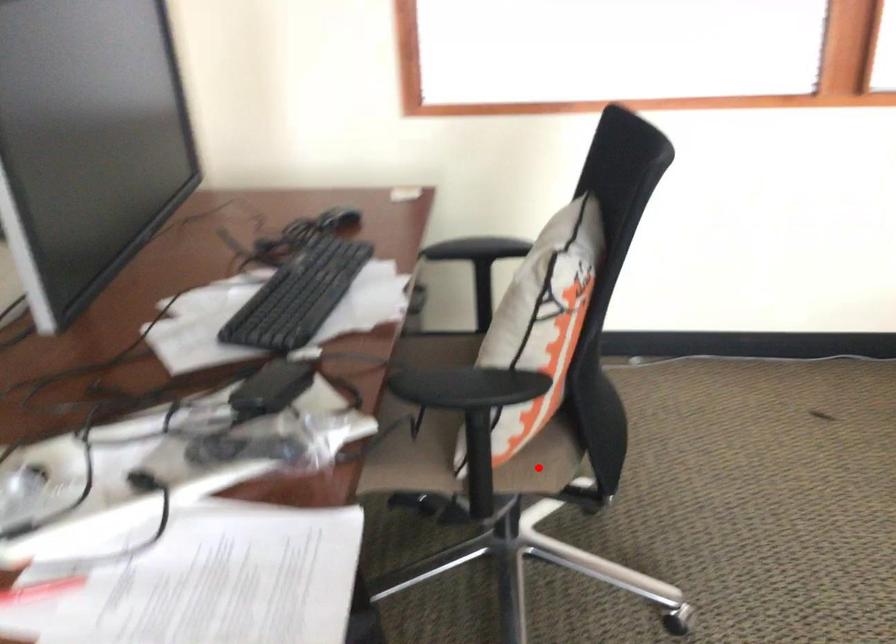
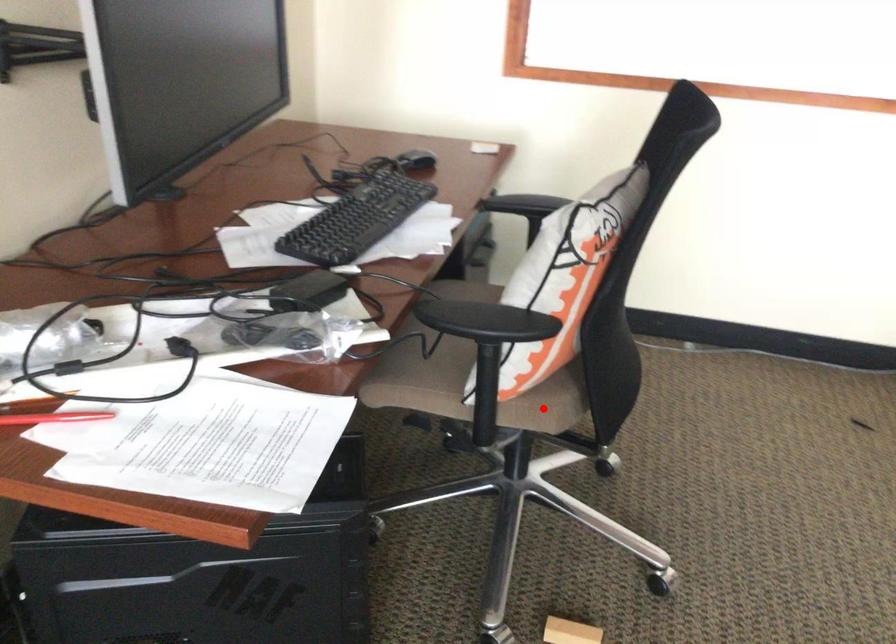
I am providing you with two images of the same scene from different viewpoints. A red point is marked on the first image and another point is marked on the second image. Is the marked point in image1 the same physical position as the marked point in image2?

Yes